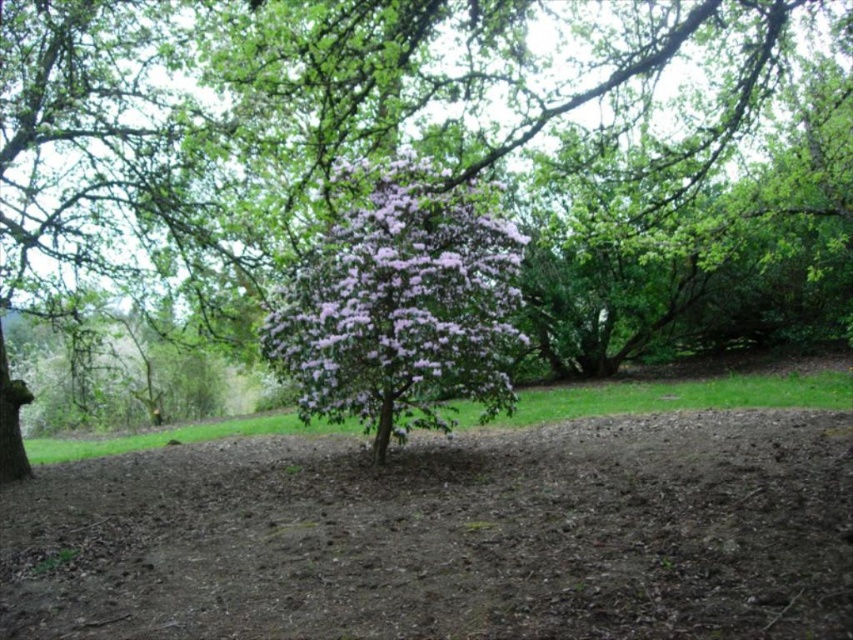
Question: Does brown/dry soil at center appear on the left side of purple leafy bush at center?

Choices:
 (A) yes
 (B) no

Answer: (A)

Question: From the image, what is the correct spatial relationship of brown/dry soil at center in relation to purple leafy bush at center?

Choices:
 (A) below
 (B) above

Answer: (A)

Question: Which object is farther from the camera taking this photo?

Choices:
 (A) purple leafy bush at center
 (B) brown/dry soil at center

Answer: (A)

Question: Does brown/dry soil at center have a smaller size compared to purple leafy bush at center?

Choices:
 (A) yes
 (B) no

Answer: (A)